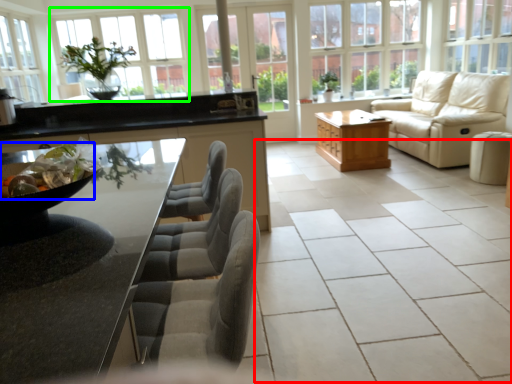
Question: Which object is the closest to the ceramic tile (highlighted by a red box)? Choose among these: food (highlighted by a blue box) or window (highlighted by a green box).

Choices:
 (A) food
 (B) window

Answer: (A)